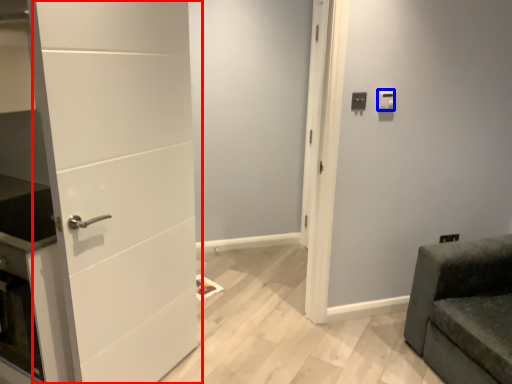
Question: Which object appears farthest to the camera in this image, door (highlighted by a red box) or light switch (highlighted by a blue box)?

Choices:
 (A) door
 (B) light switch

Answer: (B)